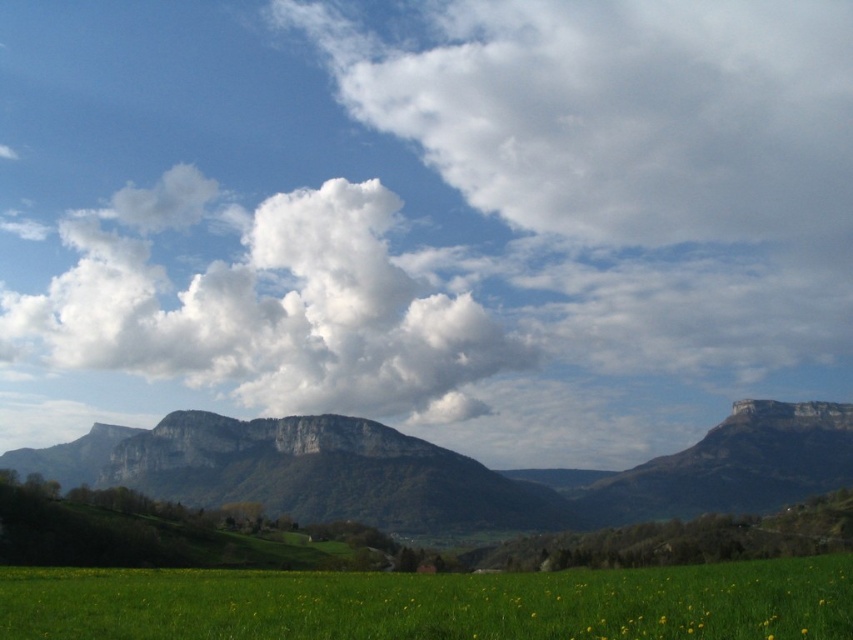
You are standing at the edge of the green grassy field at lower center and looking towards the white fluffy cloud at upper center. Which object is higher in the sky?

The white fluffy cloud at upper center is higher in the sky than the green grassy field at lower center because it is taller than the field.

You are standing at the base of the mountains in the image and want to reach the point marked at coordinates point (x=843, y=83). Given that you can walk at a speed of 5 kilometers per hour, how long would it take you to reach that point?

The point marked at coordinates point (x=843, y=83) is 750.32 meters away from the viewer. Converting meters to kilometers, it is 0.75032 kilometers. At a walking speed of 5 km per hour, the time required would be 0.75032 km divided by 5 km per hour, which equals approximately 0.15 hours. Converting hours to minutes by multiplying by 60, this results in about 9 minutes. Therefore, it would take approximately 9 minutes to reach the point.